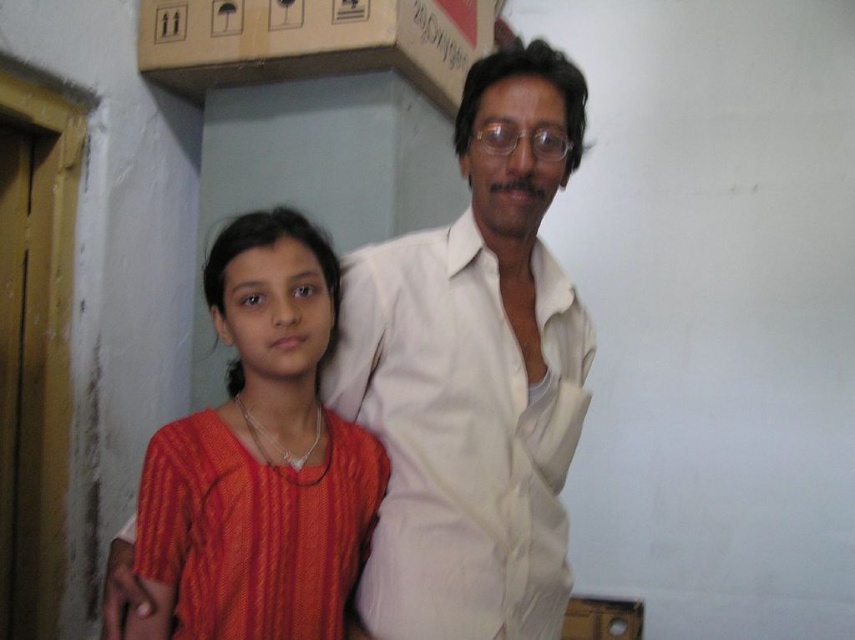
Question: Which of the following is the closest to the observer?

Choices:
 (A) (322, 337)
 (B) (488, 552)
 (C) (370, 262)

Answer: (A)

Question: Can you confirm if white smooth shirt at center is positioned to the right of white cotton shirt at upper center?

Choices:
 (A) no
 (B) yes

Answer: (A)

Question: Observing the image, what is the correct spatial positioning of white smooth shirt at center in reference to white cotton shirt at upper center?

Choices:
 (A) below
 (B) above

Answer: (B)

Question: Which object is closer to the camera taking this photo?

Choices:
 (A) white cotton shirt at upper center
 (B) matte orange dress at center

Answer: (B)

Question: Can you confirm if white smooth shirt at center is wider than matte orange dress at center?

Choices:
 (A) yes
 (B) no

Answer: (A)

Question: Based on their relative distances, which object is nearer to the matte orange dress at center?

Choices:
 (A) white cotton shirt at upper center
 (B) white smooth shirt at center

Answer: (A)